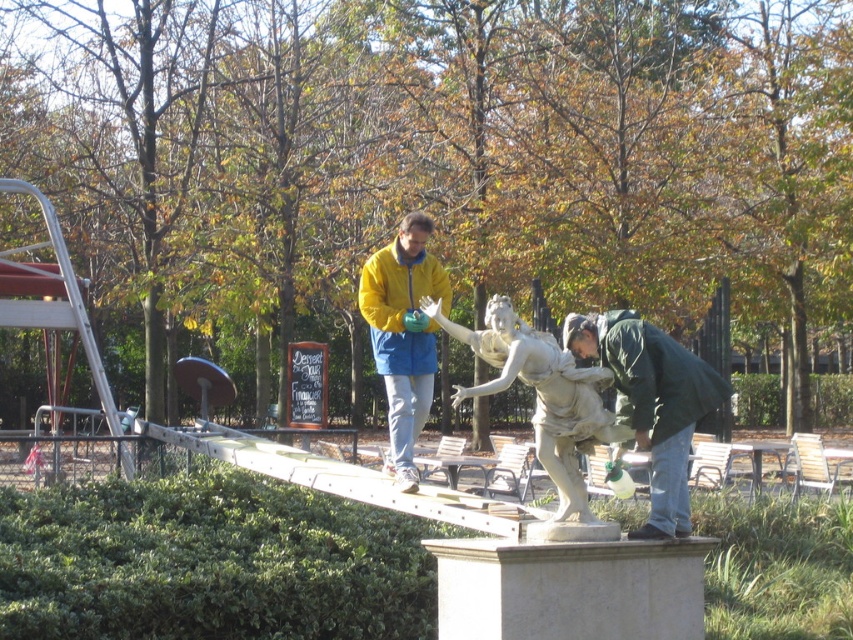
Question: Is green matte jacket at lower right bigger than yellow matte jacket at center?

Choices:
 (A) yes
 (B) no

Answer: (A)

Question: Is green matte jacket at lower right further to the viewer compared to yellow matte jacket at center?

Choices:
 (A) no
 (B) yes

Answer: (A)

Question: Which object is farther from the camera taking this photo?

Choices:
 (A) yellow matte jacket at center
 (B) white marble statue at center
 (C) green matte jacket at lower right

Answer: (A)

Question: Can you confirm if white marble statue at center is thinner than yellow matte jacket at center?

Choices:
 (A) no
 (B) yes

Answer: (A)

Question: Which object is farther from the camera taking this photo?

Choices:
 (A) yellow matte jacket at center
 (B) green matte jacket at lower right

Answer: (A)

Question: Which point is closer to the camera?

Choices:
 (A) (712, 397)
 (B) (396, 385)
 (C) (521, 349)

Answer: (C)